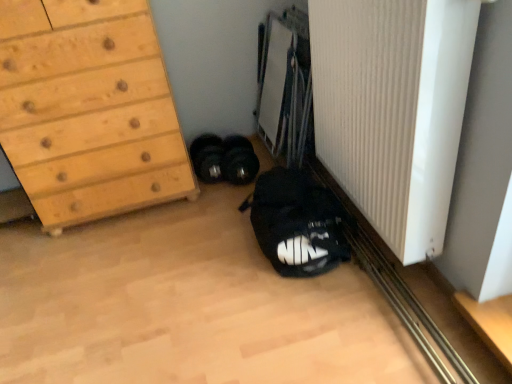
What is the approximate height of black fabric backpack at lower center?

23.36 centimeters.

Find the location of `black rubber dumbbells at center, acting as the 1th footwear starting from the right`. black rubber dumbbells at center, acting as the 1th footwear starting from the right is located at coordinates (224, 159).

What do you see at coordinates (207, 157) in the screenshot? I see `black matte sneakers at lower left, which appears as the first footwear when viewed from the left` at bounding box center [207, 157].

Locate an element on the screen. This screenshot has height=384, width=512. white ribbed radiator at lower right is located at coordinates (393, 109).

The width and height of the screenshot is (512, 384). In order to click on black fabric backpack at lower center in this screenshot , I will do `click(297, 223)`.

Measure the distance from wooden chest of drawers at left to black matte sneakers at lower left, placed as the second footwear when sorted from right to left.

wooden chest of drawers at left is 21.03 inches from black matte sneakers at lower left, placed as the second footwear when sorted from right to left.

Does wooden chest of drawers at left appear on the left side of black matte sneakers at lower left, which appears as the first footwear when viewed from the left?

Correct, you'll find wooden chest of drawers at left to the left of black matte sneakers at lower left, which appears as the first footwear when viewed from the left.

Identify the location of the 1st footwear below the wooden chest of drawers at left (from the image's perspective). (207, 157).

Between wooden chest of drawers at left and black matte sneakers at lower left, which appears as the first footwear when viewed from the left, which one is positioned behind?

black matte sneakers at lower left, which appears as the first footwear when viewed from the left, is more distant.

Considering the relative sizes of black matte sneakers at lower left, placed as the second footwear when sorted from right to left, and black rubber dumbbells at center, acting as the 1th footwear starting from the right, in the image provided, is black matte sneakers at lower left, placed as the second footwear when sorted from right to left, taller than black rubber dumbbells at center, acting as the 1th footwear starting from the right,?

No.

Which is closer, (210, 144) or (228, 163)?

Point (210, 144) appears to be farther away from the viewer than point (228, 163).

Consider the image. Does black matte sneakers at lower left, placed as the second footwear when sorted from right to left, have a smaller size compared to black rubber dumbbells at center, acting as the 1th footwear starting from the right?

Yes.

From the image's perspective, relative to wooden chest of drawers at left, is black rubber dumbbells at center, marked as the second footwear in a left-to-right arrangement, above or below?

black rubber dumbbells at center, marked as the second footwear in a left-to-right arrangement, is below wooden chest of drawers at left.

Is black rubber dumbbells at center, marked as the second footwear in a left-to-right arrangement, at the right side of wooden chest of drawers at left?

Indeed, black rubber dumbbells at center, marked as the second footwear in a left-to-right arrangement, is positioned on the right side of wooden chest of drawers at left.

Considering the sizes of objects black rubber dumbbells at center, acting as the 1th footwear starting from the right, and wooden chest of drawers at left in the image provided, who is taller, black rubber dumbbells at center, acting as the 1th footwear starting from the right, or wooden chest of drawers at left?

Standing taller between the two is wooden chest of drawers at left.

Would you say wooden chest of drawers at left is part of black rubber dumbbells at center, acting as the 1th footwear starting from the right,'s contents?

No, black rubber dumbbells at center, acting as the 1th footwear starting from the right, does not contain wooden chest of drawers at left.

This screenshot has height=384, width=512. Find the location of `radiator in front of the wooden chest of drawers at left`. radiator in front of the wooden chest of drawers at left is located at coordinates (393, 109).

From a real-world perspective, between white ribbed radiator at lower right and wooden chest of drawers at left, who is vertically lower?

wooden chest of drawers at left is physically lower.

From the image's perspective, relative to wooden chest of drawers at left, is white ribbed radiator at lower right above or below?

Based on their image positions, white ribbed radiator at lower right is located beneath wooden chest of drawers at left.

Is black matte sneakers at lower left, which appears as the first footwear when viewed from the left, situated inside black fabric backpack at lower center or outside?

black matte sneakers at lower left, which appears as the first footwear when viewed from the left, exists outside the volume of black fabric backpack at lower center.

How different are the orientations of black matte sneakers at lower left, placed as the second footwear when sorted from right to left, and black fabric backpack at lower center in degrees?

The angular difference between black matte sneakers at lower left, placed as the second footwear when sorted from right to left, and black fabric backpack at lower center is 1.08 degrees.

Is there a large distance between black matte sneakers at lower left, which appears as the first footwear when viewed from the left, and black fabric backpack at lower center?

black matte sneakers at lower left, which appears as the first footwear when viewed from the left, is actually quite close to black fabric backpack at lower center.

Locate an element on the screen. The image size is (512, 384). shoulder bag in front of the black matte sneakers at lower left, which appears as the first footwear when viewed from the left is located at coordinates (297, 223).

Does black matte sneakers at lower left, placed as the second footwear when sorted from right to left, contain wooden chest of drawers at left?

Actually, wooden chest of drawers at left is outside black matte sneakers at lower left, placed as the second footwear when sorted from right to left.

Consider the image. Considering the relative sizes of black matte sneakers at lower left, placed as the second footwear when sorted from right to left, and wooden chest of drawers at left in the image provided, is black matte sneakers at lower left, placed as the second footwear when sorted from right to left, smaller than wooden chest of drawers at left?

Yes.

Between black matte sneakers at lower left, placed as the second footwear when sorted from right to left, and wooden chest of drawers at left, which one appears on the left side from the viewer's perspective?

wooden chest of drawers at left is more to the left.

Considering the sizes of black matte sneakers at lower left, placed as the second footwear when sorted from right to left, and wooden chest of drawers at left in the image, is black matte sneakers at lower left, placed as the second footwear when sorted from right to left, taller or shorter than wooden chest of drawers at left?

In the image, black matte sneakers at lower left, placed as the second footwear when sorted from right to left, appears to be shorter than wooden chest of drawers at left.

From the picture: From a real-world perspective, is white ribbed radiator at lower right above or below black rubber dumbbells at center, marked as the second footwear in a left-to-right arrangement?

From a real-world perspective, white ribbed radiator at lower right is physically above black rubber dumbbells at center, marked as the second footwear in a left-to-right arrangement.

Can you confirm if white ribbed radiator at lower right is bigger than black rubber dumbbells at center, acting as the 1th footwear starting from the right?

Yes.

From the image's perspective, which one is positioned higher, white ribbed radiator at lower right or black rubber dumbbells at center, acting as the 1th footwear starting from the right?

white ribbed radiator at lower right.

Find the location of a particular element. This screenshot has width=512, height=384. chest of drawers lying on the left of black matte sneakers at lower left, placed as the second footwear when sorted from right to left is located at coordinates (88, 110).

Find the location of a particular element. The image size is (512, 384). footwear that appears on the right of black matte sneakers at lower left, which appears as the first footwear when viewed from the left is located at coordinates (224, 159).

Based on the photo, from the image, which object appears to be nearer to black fabric backpack at lower center, black rubber dumbbells at center, acting as the 1th footwear starting from the right, or wooden chest of drawers at left?

black rubber dumbbells at center, acting as the 1th footwear starting from the right.

Which object lies further to the anchor point wooden chest of drawers at left, white ribbed radiator at lower right or black rubber dumbbells at center, marked as the second footwear in a left-to-right arrangement?

white ribbed radiator at lower right is positioned further to the anchor wooden chest of drawers at left.

Estimate the real-world distances between objects in this image. Which object is further from white ribbed radiator at lower right, black fabric backpack at lower center or black rubber dumbbells at center, acting as the 1th footwear starting from the right?

The object further to white ribbed radiator at lower right is black rubber dumbbells at center, acting as the 1th footwear starting from the right.

Considering their positions, is white ribbed radiator at lower right positioned closer to black fabric backpack at lower center than black rubber dumbbells at center, marked as the second footwear in a left-to-right arrangement?

Among the two, white ribbed radiator at lower right is located nearer to black fabric backpack at lower center.

Which object lies nearer to the anchor point wooden chest of drawers at left, black rubber dumbbells at center, marked as the second footwear in a left-to-right arrangement, or white ribbed radiator at lower right?

black rubber dumbbells at center, marked as the second footwear in a left-to-right arrangement, is positioned closer to the anchor wooden chest of drawers at left.

Which object lies nearer to the anchor point black rubber dumbbells at center, marked as the second footwear in a left-to-right arrangement, wooden chest of drawers at left or black matte sneakers at lower left, which appears as the first footwear when viewed from the left?

black matte sneakers at lower left, which appears as the first footwear when viewed from the left, is closer to black rubber dumbbells at center, marked as the second footwear in a left-to-right arrangement.

Based on their spatial positions, is black rubber dumbbells at center, marked as the second footwear in a left-to-right arrangement, or wooden chest of drawers at left further from white ribbed radiator at lower right?

wooden chest of drawers at left lies further to white ribbed radiator at lower right than the other object.

Which object lies nearer to the anchor point black rubber dumbbells at center, acting as the 1th footwear starting from the right, white ribbed radiator at lower right or black matte sneakers at lower left, placed as the second footwear when sorted from right to left?

black matte sneakers at lower left, placed as the second footwear when sorted from right to left, is positioned closer to the anchor black rubber dumbbells at center, acting as the 1th footwear starting from the right.

In order to click on shoulder bag between wooden chest of drawers at left and white ribbed radiator at lower right in the horizontal direction in this screenshot , I will do `click(297, 223)`.

At what (x,y) coordinates should I click in order to perform the action: click on chest of drawers between white ribbed radiator at lower right and black matte sneakers at lower left, which appears as the first footwear when viewed from the left, in the front-back direction. Please return your answer as a coordinate pair (x, y). Looking at the image, I should click on (88, 110).

Where is `footwear located between white ribbed radiator at lower right and black matte sneakers at lower left, placed as the second footwear when sorted from right to left, in the depth direction`? The height and width of the screenshot is (384, 512). footwear located between white ribbed radiator at lower right and black matte sneakers at lower left, placed as the second footwear when sorted from right to left, in the depth direction is located at coordinates (224, 159).

Image resolution: width=512 pixels, height=384 pixels. I want to click on shoulder bag positioned between white ribbed radiator at lower right and black matte sneakers at lower left, which appears as the first footwear when viewed from the left, from near to far, so click(x=297, y=223).